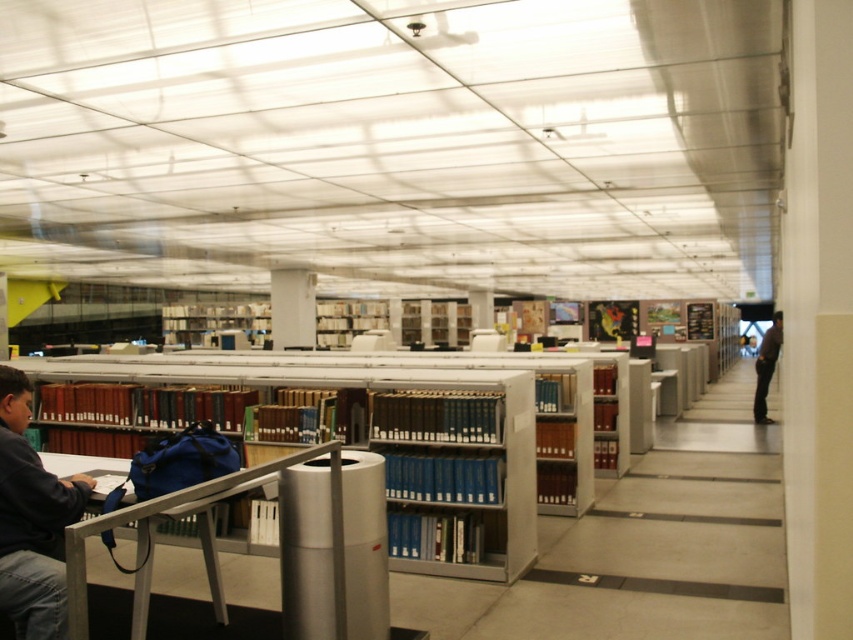
You are a librarian who needs to place both the dark blue jacket at lower left and the dark brown leather jacket at right into a storage bin. The bin can only hold items that take up the same amount of space. Can you fit both jackets into the bin?

The dark blue jacket at lower left occupies less space than the dark brown leather jacket at right, so they cannot be placed in the same bin since their space requirements differ.